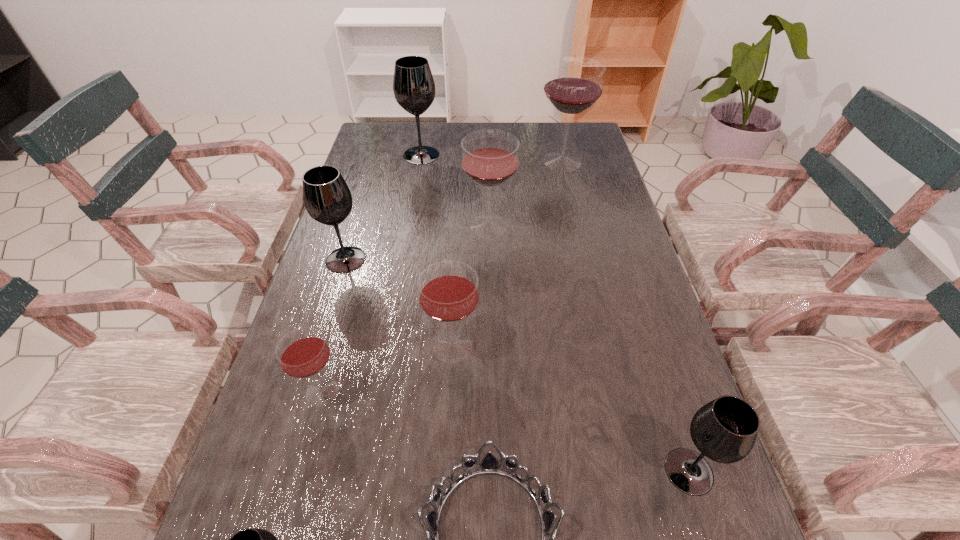
Where is `vacant area between the rightmost red wineglass and the third farthest gray wineglass`? Image resolution: width=960 pixels, height=540 pixels. vacant area between the rightmost red wineglass and the third farthest gray wineglass is located at coordinates (626, 316).

Locate an element on the screen. This screenshot has width=960, height=540. blank region between the second nearest wineglass and the third farthest wineglass is located at coordinates (588, 348).

The height and width of the screenshot is (540, 960). I want to click on vacant area that lies between the second smallest gray wineglass and the leftmost red wineglass, so click(506, 431).

Identify the location of object that stands as the eighth closest to the fourth farthest wineglass. This screenshot has width=960, height=540. (724, 430).

Identify which object is located as the third nearest to the shortest object. Please provide its 2D coordinates. Your answer should be formatted as a tuple, i.e. [(x, y)], where the tuple contains the x and y coordinates of a point satisfying the conditions above.

[(724, 430)]

You are a GUI agent. You are given a task and a screenshot of the screen. Output one action in this format:
    pyautogui.click(x=<x>, y=<y>)
    Task: Click on the wineglass that stands as the second closest to the second nearest red wineglass
    This screenshot has height=540, width=960.
    Given the screenshot: What is the action you would take?
    pyautogui.click(x=327, y=198)

Locate which wineglass is the closest to the nearest wineglass. Please provide its 2D coordinates. Your answer should be formatted as a tuple, i.e. [(x, y)], where the tuple contains the x and y coordinates of a point satisfying the conditions above.

[(303, 352)]

Choose which red wineglass is the third nearest neighbor to the farthest red wineglass. Please provide its 2D coordinates. Your answer should be formatted as a tuple, i.e. [(x, y)], where the tuple contains the x and y coordinates of a point satisfying the conditions above.

[(303, 352)]

Locate which red wineglass is the third closest to the nearest wineglass. Please provide its 2D coordinates. Your answer should be formatted as a tuple, i.e. [(x, y)], where the tuple contains the x and y coordinates of a point satisfying the conditions above.

[(489, 158)]

Identify which gray wineglass is the third nearest to the fifth farthest wineglass. Please provide its 2D coordinates. Your answer should be formatted as a tuple, i.e. [(x, y)], where the tuple contains the x and y coordinates of a point satisfying the conditions above.

[(724, 430)]